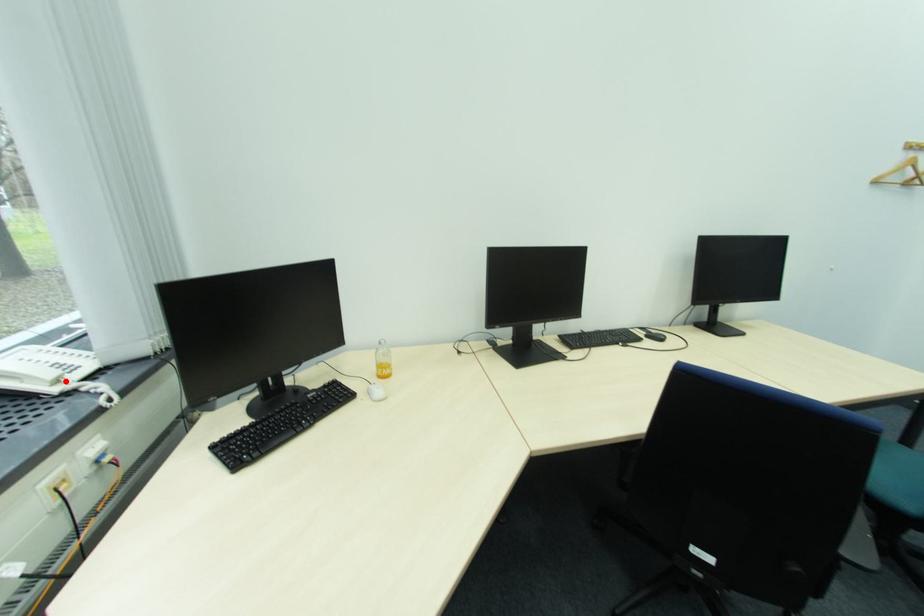
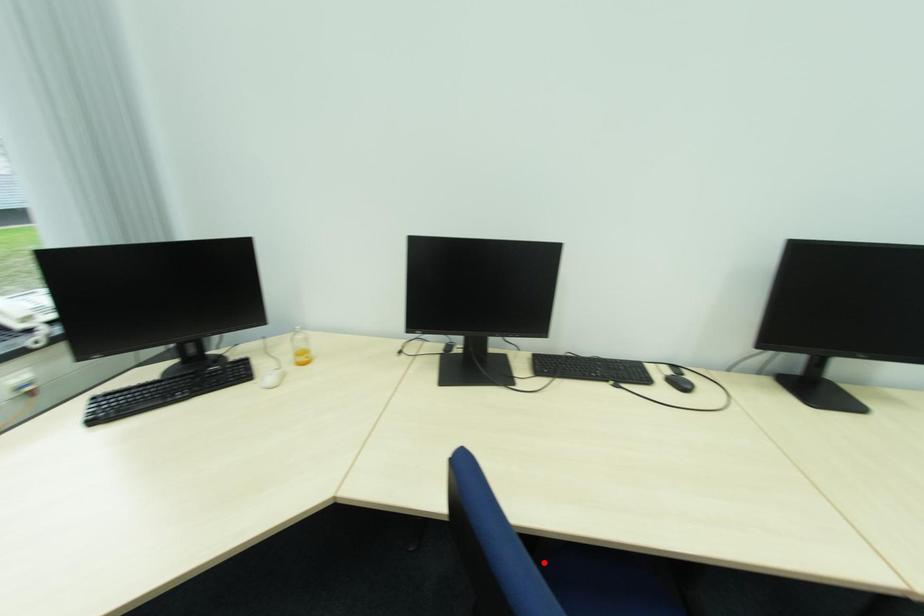
I am providing you with two images of the same scene from different viewpoints. A red point is marked on the first image and another point is marked on the second image. Are the points marked in image1 and image2 representing the same 3D position?

No